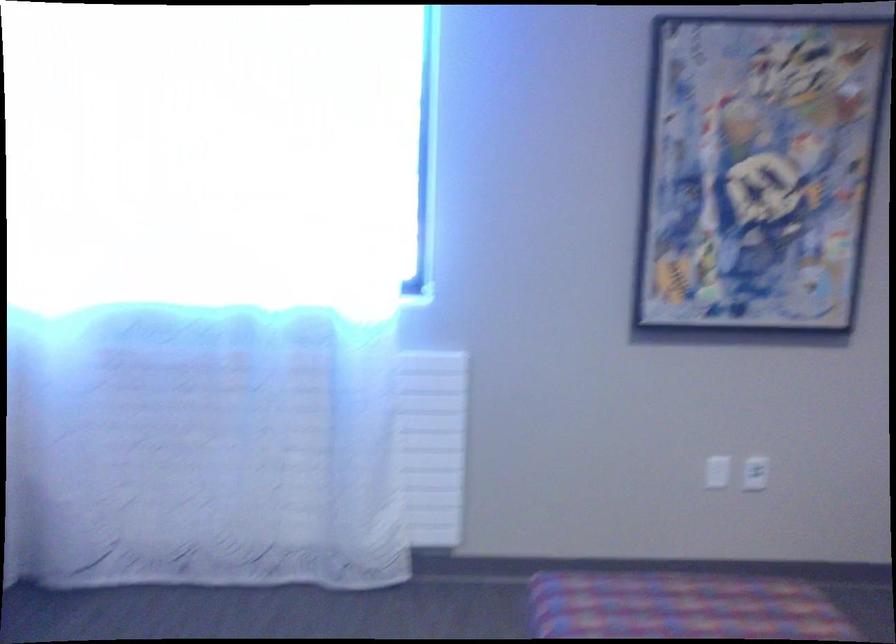
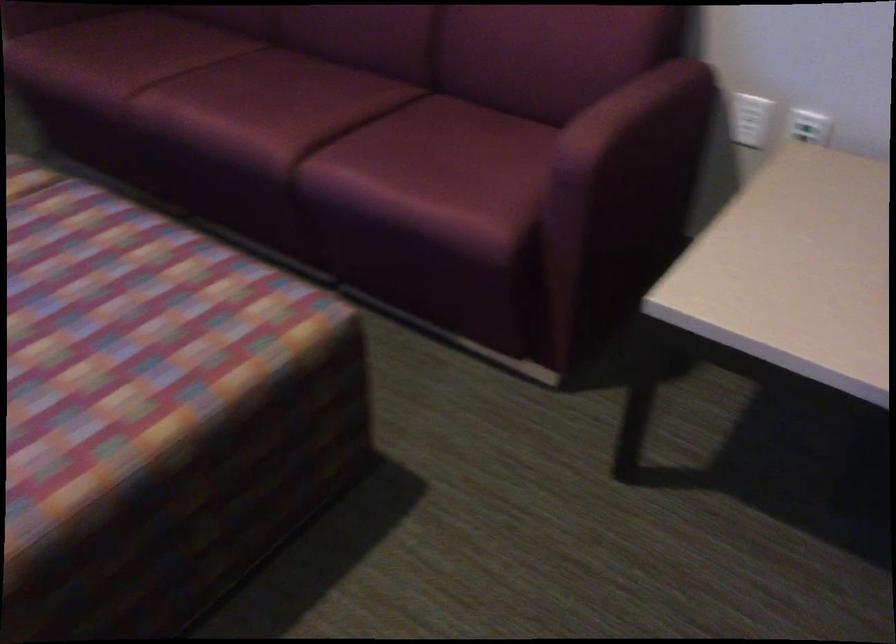
How did the camera likely rotate?

The camera's rotation is toward right-down.